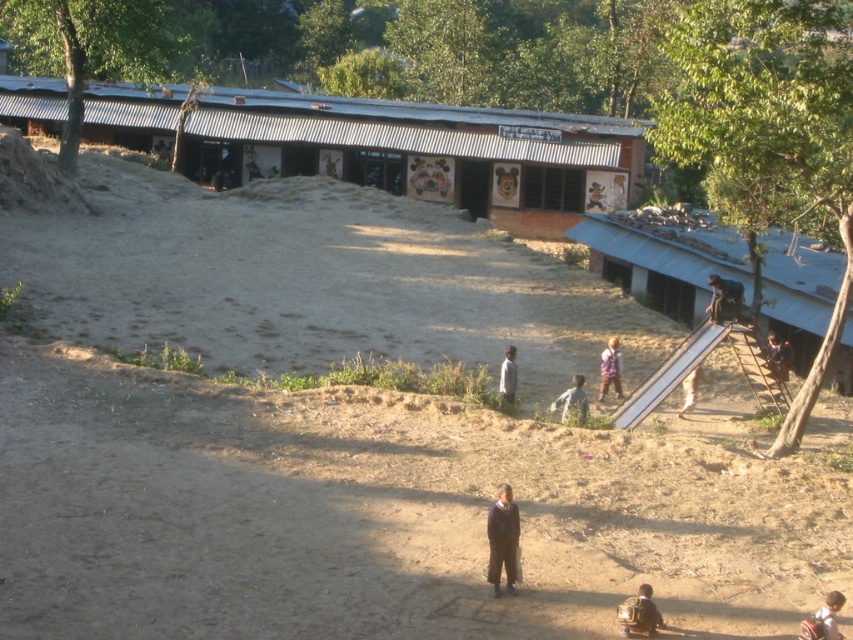
Does blue corrugated metal hut at right appear on the left side of white matte shirt at center?

No, blue corrugated metal hut at right is not to the left of white matte shirt at center.

Does blue corrugated metal hut at right have a lesser width compared to white matte shirt at center?

In fact, blue corrugated metal hut at right might be wider than white matte shirt at center.

Where is `blue corrugated metal hut at right`? The height and width of the screenshot is (640, 853). blue corrugated metal hut at right is located at coordinates (662, 260).

Does dark blue jeans at lower right appear over white fabric pants at right?

Yes, dark blue jeans at lower right is above white fabric pants at right.

Does point (770, 358) come behind point (691, 401)?

Yes, it is behind point (691, 401).

What are the coordinates of `dark blue jeans at lower right` in the screenshot? It's located at (776, 356).

Is brown sandy dirt track at lower center bigger than light brown fabric shirt at center?

Correct, brown sandy dirt track at lower center is larger in size than light brown fabric shirt at center.

Between point (120, 435) and point (616, 348), which one is positioned behind?

Point (616, 348)

Image resolution: width=853 pixels, height=640 pixels. What are the coordinates of `brown sandy dirt track at lower center` in the screenshot? It's located at (373, 516).